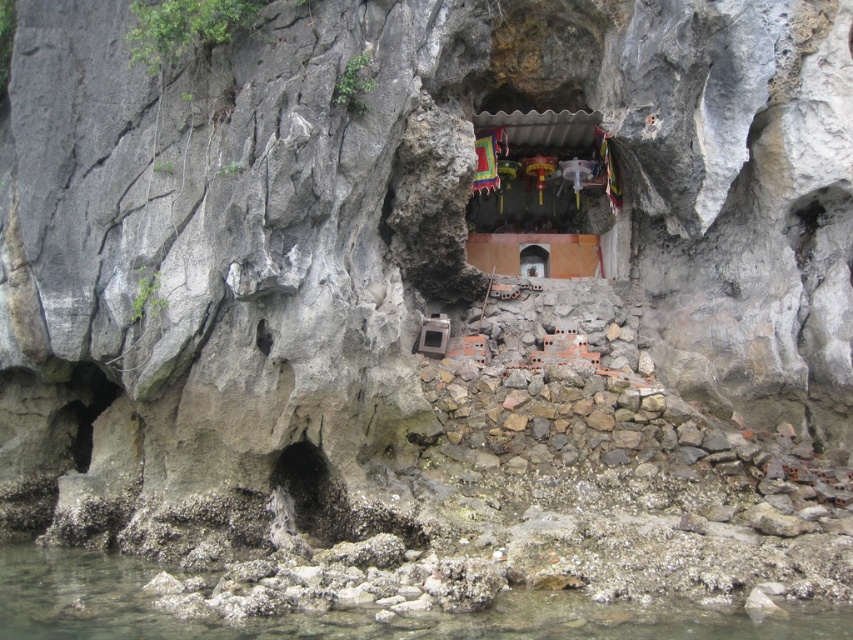
Question: Among these points, which one is nearest to the camera?

Choices:
 (A) (798, 620)
 (B) (521, 260)

Answer: (A)

Question: Which point is farther to the camera?

Choices:
 (A) (534, 272)
 (B) (846, 609)

Answer: (A)

Question: Which of the following is the closest to the observer?

Choices:
 (A) clear water at lower left
 (B) matte stone altar at center

Answer: (A)

Question: Does clear water at lower left have a greater width compared to matte stone altar at center?

Choices:
 (A) no
 (B) yes

Answer: (B)

Question: Can you confirm if clear water at lower left is positioned to the right of matte stone altar at center?

Choices:
 (A) no
 (B) yes

Answer: (A)

Question: Does clear water at lower left have a lesser width compared to matte stone altar at center?

Choices:
 (A) yes
 (B) no

Answer: (B)